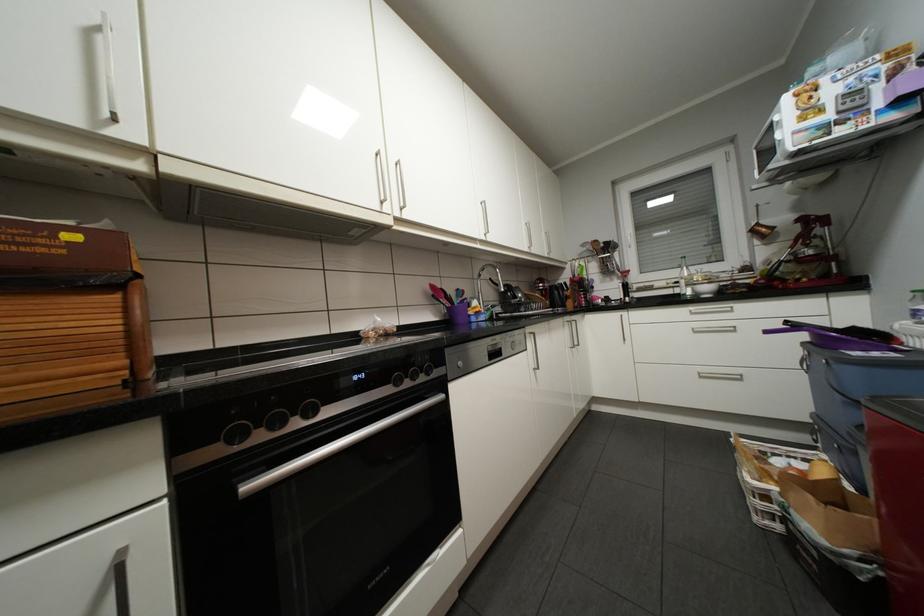
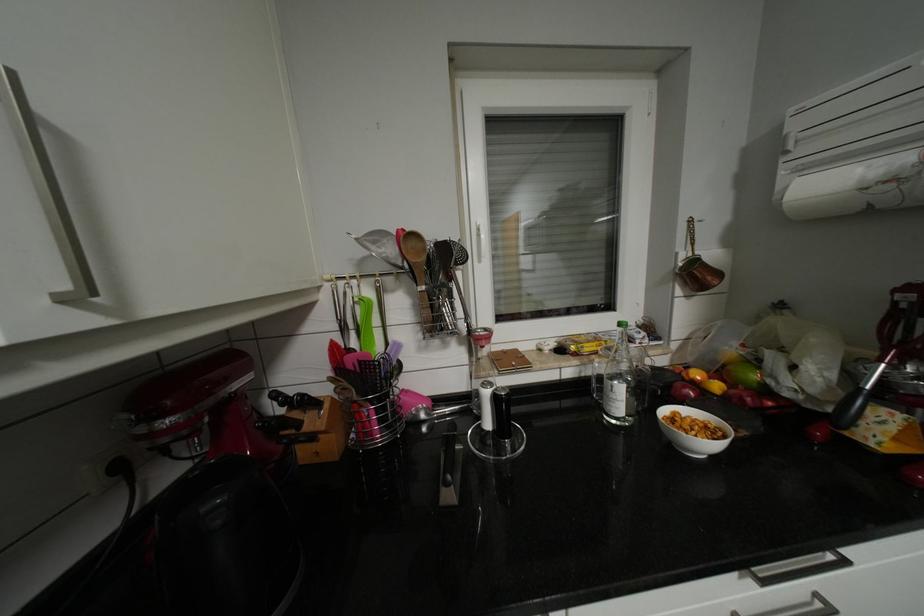
Locate, in the second image, the point that corresponds to point 603,240 in the first image.

(421, 235)